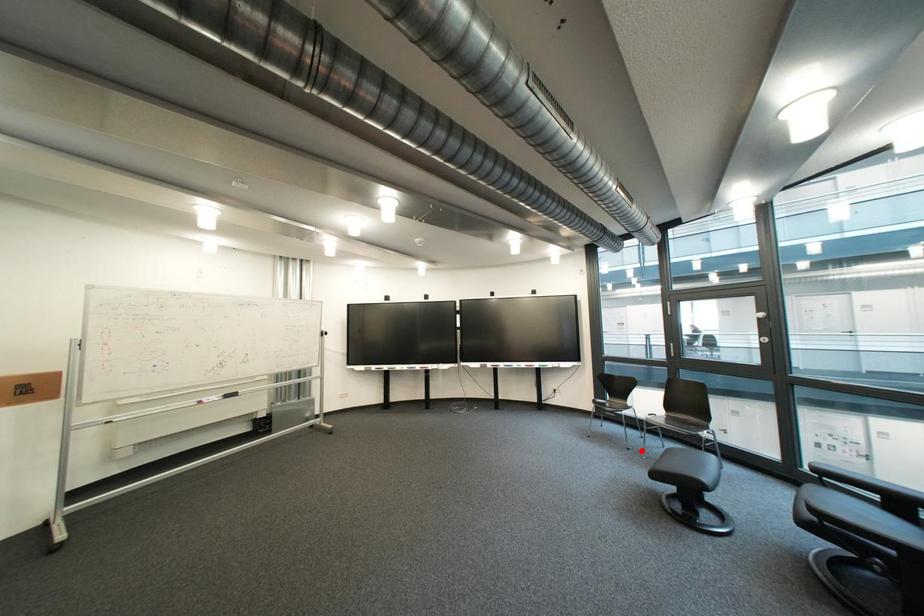
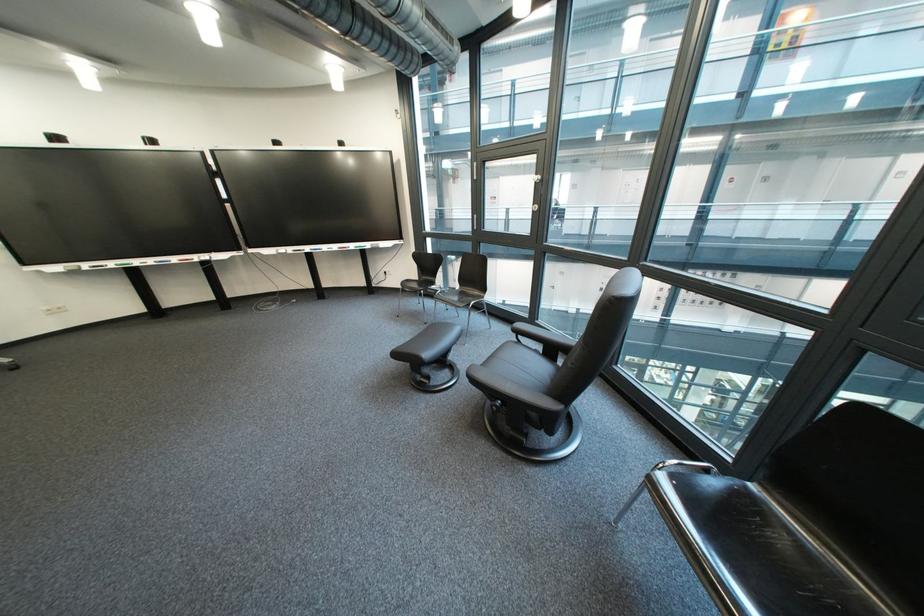
Locate, in the second image, the point that corresponds to the highlighted location in the first image.

(439, 325)